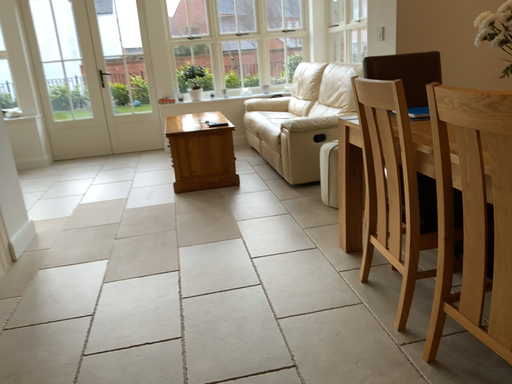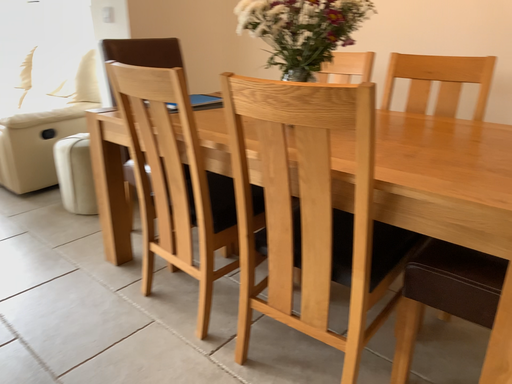
Question: Which way did the camera rotate in the video?

Choices:
 (A) rotated right
 (B) rotated left

Answer: (A)